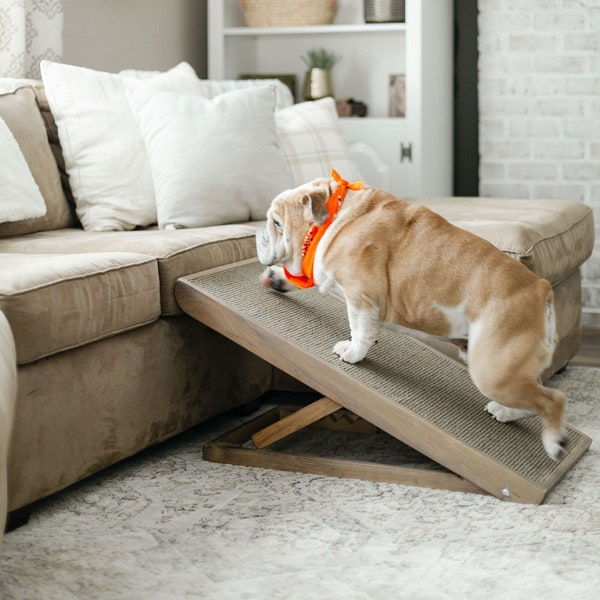
You are a GUI agent. You are given a task and a screenshot of the screen. Output one action in this format:
    pyautogui.click(x=<x>, y=<y>)
    Task: Click on the floor
    The image size is (600, 600).
    Given the screenshot: What is the action you would take?
    pyautogui.click(x=352, y=518), pyautogui.click(x=582, y=386)